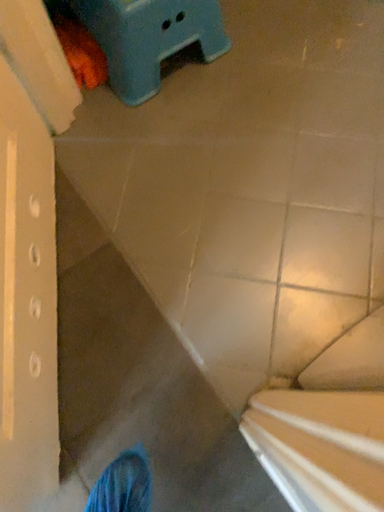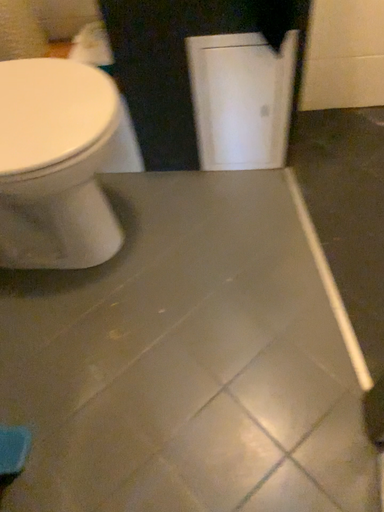
Question: Which way did the camera rotate in the video?

Choices:
 (A) rotated left
 (B) rotated right

Answer: (B)